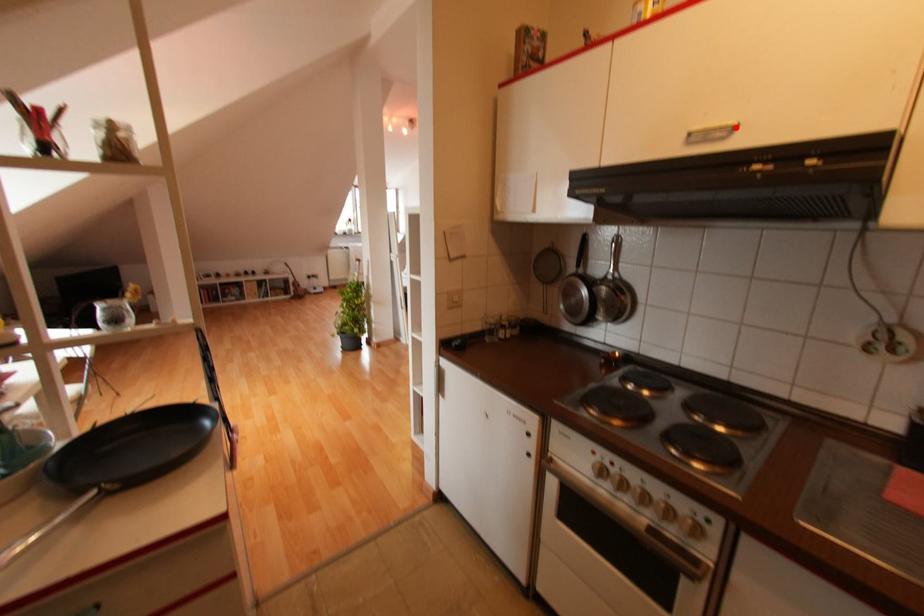
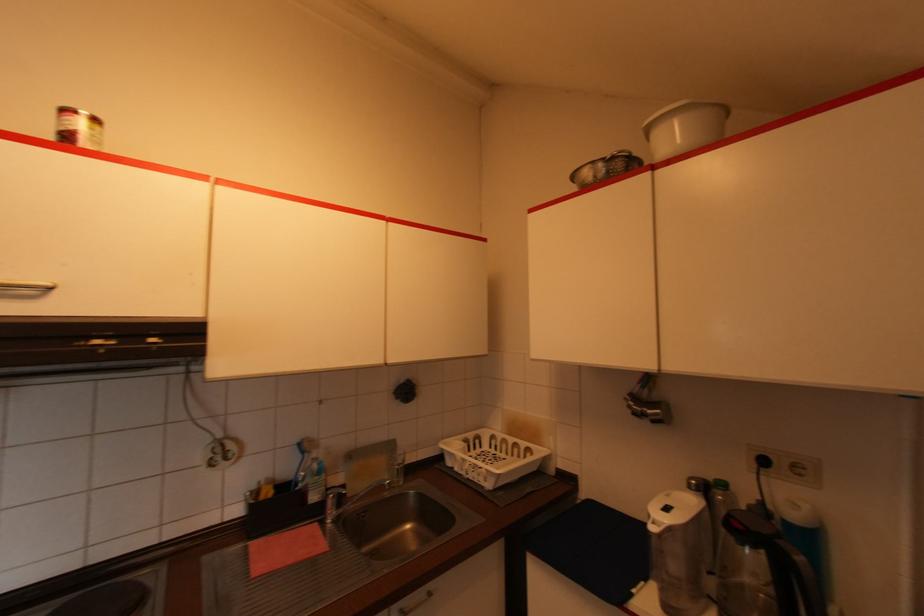
The point at the highlighted location is marked in the first image. Where is the corresponding point in the second image?

(47, 289)